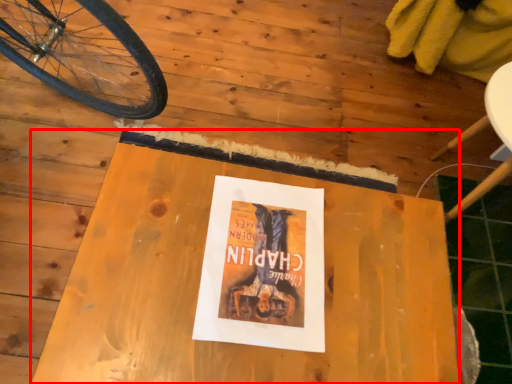
Question: Considering the relative positions of table (annotated by the red box) and paperback book in the image provided, where is table (annotated by the red box) located with respect to the staircase?

Choices:
 (A) right
 (B) left

Answer: (B)